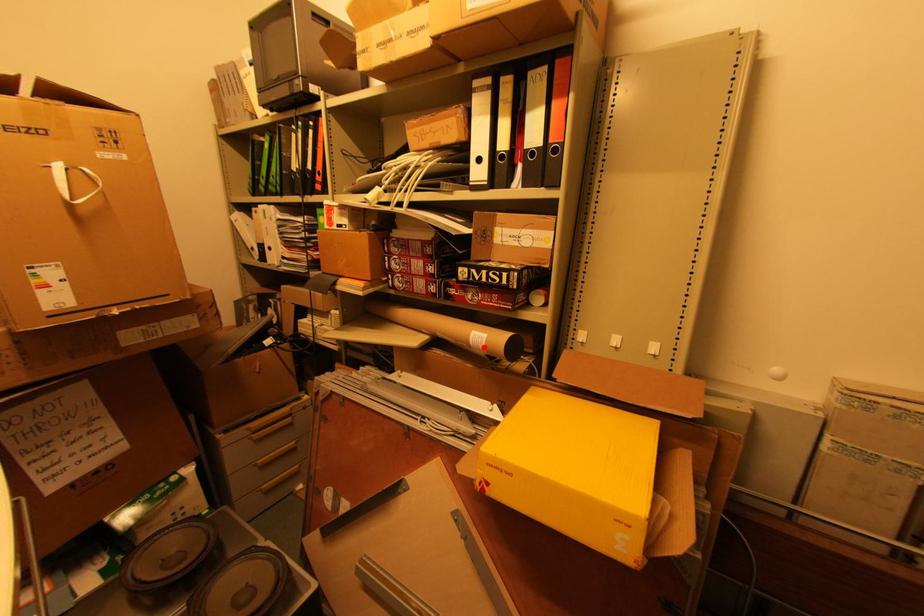
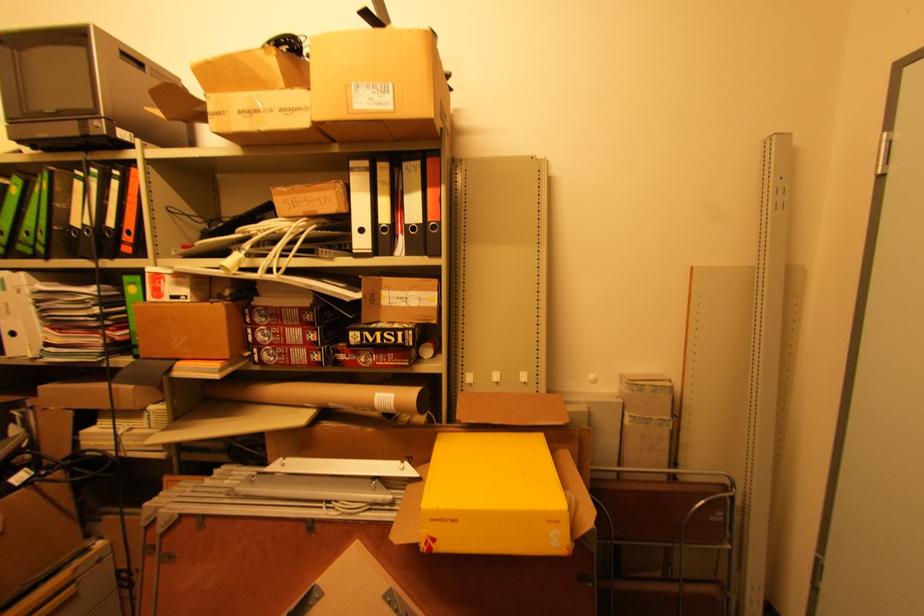
Locate, in the second image, the point that corresponds to the highlighted location in the first image.

(392, 408)